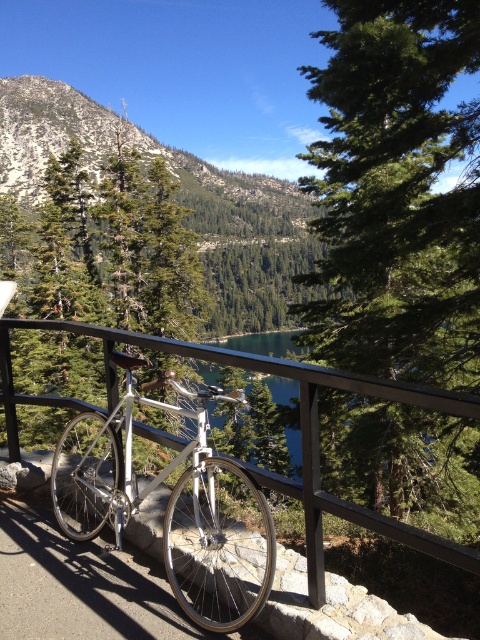
You are standing at the stone ledge where the bicycle is parked. You want to take a photo of the black metal fence at center and the green leafy trees at upper left. Which object should you frame first in your camera viewfinder to ensure both are in the shot?

You should frame the green leafy trees at upper left first because they are positioned on the left side of the black metal fence at center, so starting with them ensures both objects are included in the photo.

You are standing in the outdoor scene and want to take a photo of the silver metallic bicycle at center and the green leafy trees at upper left. Which object will appear larger in the photo?

The silver metallic bicycle at center will appear larger in the photo because it is closer to the viewer than the green leafy trees at upper left.

You are a hiker who wants to take a photo of the silver metallic bicycle at center and the black metal fence at center. Which object should you focus on first if you want to capture both in the frame without moving the camera?

The silver metallic bicycle at center is positioned on the left side of the black metal fence at center, so you should focus on the silver metallic bicycle at center first to ensure both are in the frame without moving the camera.